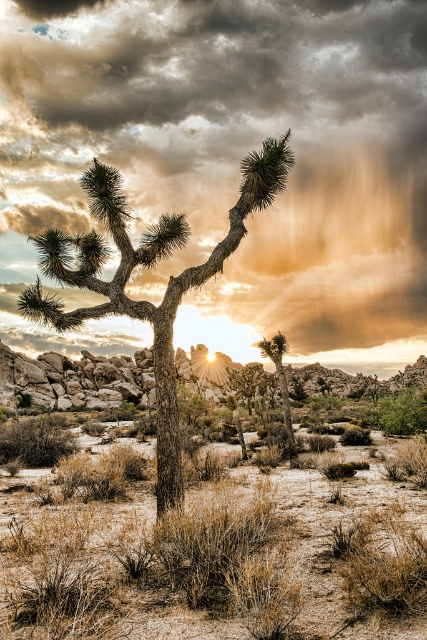
Does cloudy sky at upper center have a lesser width compared to green leafy tree at center?

No, cloudy sky at upper center is not thinner than green leafy tree at center.

Is cloudy sky at upper center smaller than green leafy tree at center?

No.

Does point (82, 54) lie in front of point (277, 348)?

That is False.

Locate an element on the screen. The image size is (427, 640). cloudy sky at upper center is located at coordinates (228, 161).

Between point (125, 224) and point (260, 353), which one is positioned in front?

Point (125, 224) is in front.

Does matte brown joshua tree at center have a lesser height compared to green leafy tree at center?

No.

Between point (108, 176) and point (280, 360), which one is positioned behind?

The point (280, 360) is more distant.

You are a GUI agent. You are given a task and a screenshot of the screen. Output one action in this format:
    pyautogui.click(x=<x>, y=<y>)
    Task: Click on the matte brown joshua tree at center
    
    Given the screenshot: What is the action you would take?
    pyautogui.click(x=148, y=266)

This screenshot has height=640, width=427. Describe the element at coordinates (228, 161) in the screenshot. I see `cloudy sky at upper center` at that location.

Between cloudy sky at upper center and matte brown joshua tree at center, which one has more height?

With more height is cloudy sky at upper center.

Who is more forward, (295, 289) or (245, 173)?

Positioned in front is point (245, 173).

Locate an element on the screen. Image resolution: width=427 pixels, height=640 pixels. cloudy sky at upper center is located at coordinates (228, 161).